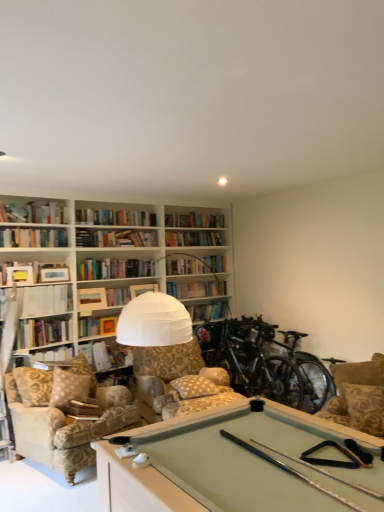
Question: In terms of size, does white paper at upper left, the second book positioned from the right, appear bigger or smaller than velvet beige armchair at lower left?

Choices:
 (A) big
 (B) small

Answer: (B)

Question: In terms of width, does white paper at upper left, the 1th book viewed from the left, look wider or thinner when compared to velvet beige armchair at lower left?

Choices:
 (A) thin
 (B) wide

Answer: (A)

Question: Considering the real-world distances, which object is farthest from the velvet beige armchair at lower left?

Choices:
 (A) hardcover book at center, the second book in the left-to-right sequence
 (B) white paper at upper left, which is the 2th book from bottom to top
 (C) green matte bicycle at right
 (D) patterned fabric armchair at right
 (E) white dotted fabric pillow at center

Answer: (D)

Question: Which object is positioned closest to the white dotted fabric pillow at center?

Choices:
 (A) white paper at upper left, the 1th book viewed from the left
 (B) green matte bicycle at right
 (C) patterned fabric armchair at right
 (D) velvet beige armchair at lower left
 (E) hardcover book at center, the first book positioned from the right

Answer: (B)